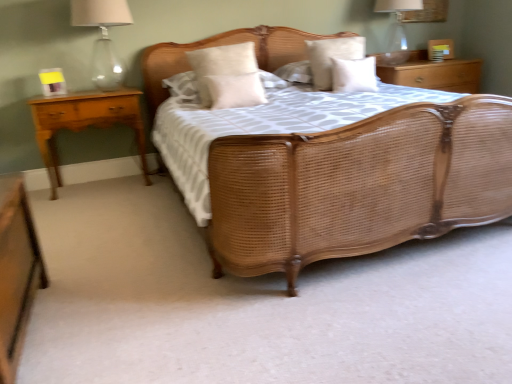
Where is `free point behind wooden nightstand at lower left, which ranks as the 2th nightstand in left-to-right order`? free point behind wooden nightstand at lower left, which ranks as the 2th nightstand in left-to-right order is located at coordinates (108, 264).